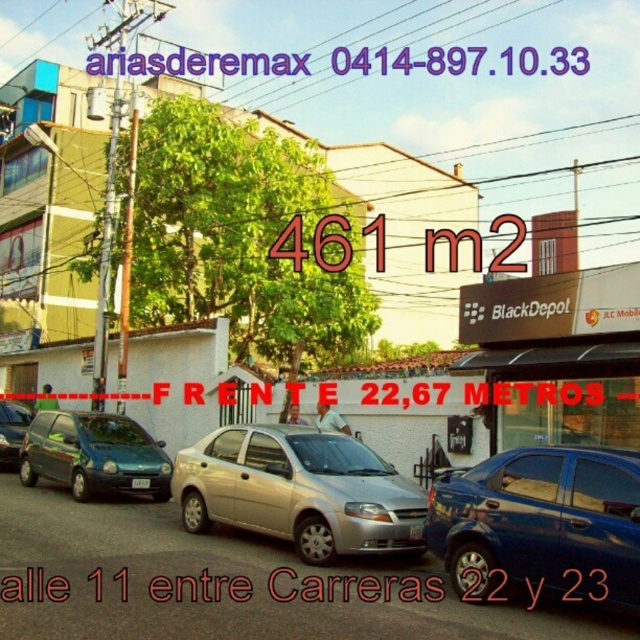
Is satin silver sedan at center taller than metallic green hatchback at left?

In fact, satin silver sedan at center may be shorter than metallic green hatchback at left.

Is point (317, 532) positioned after point (109, 417)?

No, it is not.

Where is `satin silver sedan at center`? satin silver sedan at center is located at coordinates (298, 490).

Does blue metallic car at center have a greater width compared to matte black sedan at left?

In fact, blue metallic car at center might be narrower than matte black sedan at left.

Can you confirm if blue metallic car at center is positioned to the left of matte black sedan at left?

In fact, blue metallic car at center is to the right of matte black sedan at left.

The height and width of the screenshot is (640, 640). Identify the location of blue metallic car at center. (541, 524).

This screenshot has height=640, width=640. I want to click on blue metallic car at center, so click(x=541, y=524).

Is white matte signboard at center thinner than satin silver sedan at center?

Indeed, white matte signboard at center has a lesser width compared to satin silver sedan at center.

Is white matte signboard at center further to the viewer compared to satin silver sedan at center?

Yes, it is.

Does point (612, 403) lie in front of point (348, 460)?

That is False.

Identify the location of white matte signboard at center. Image resolution: width=640 pixels, height=640 pixels. (556, 356).